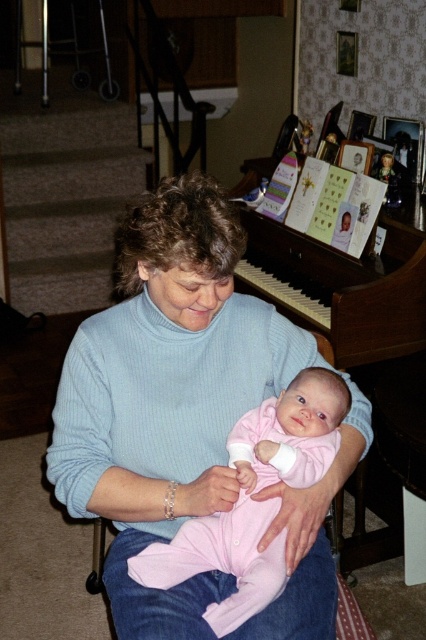
Describe the element at coordinates (255, 500) in the screenshot. I see `pink matte onesie at center` at that location.

Who is lower down, pink matte onesie at center or wooden piano at upper center?

pink matte onesie at center

Between point (244, 448) and point (290, 300), which one is positioned in front?

Point (244, 448) is more forward.

I want to click on pink matte onesie at center, so 255,500.

How far apart are light blue sweater at center and wooden piano at upper center?

A distance of 35.87 inches exists between light blue sweater at center and wooden piano at upper center.

Between light blue sweater at center and wooden piano at upper center, which one is positioned lower?

light blue sweater at center

Measure the distance between point [328,480] and camera.

They are 4.18 feet apart.

Where is `light blue sweater at center`? light blue sweater at center is located at coordinates (166, 394).

Between light blue sweater at center and pink matte onesie at center, which one is positioned higher?

Positioned higher is light blue sweater at center.

Is light blue sweater at center further to camera compared to pink matte onesie at center?

No, it is in front of pink matte onesie at center.

Is point (175, 264) positioned behind point (244, 589)?

No, it is in front of (244, 589).

Find the location of a particular element. The image size is (426, 640). light blue sweater at center is located at coordinates (166, 394).